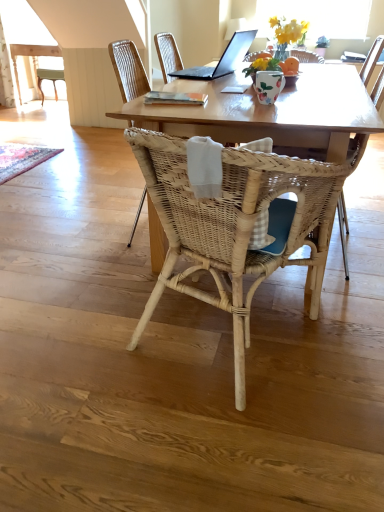
Locate an element on the screen. free area below woven wood chair at center, positioned as the first chair in front-to-back order (from a real-world perspective) is located at coordinates click(223, 334).